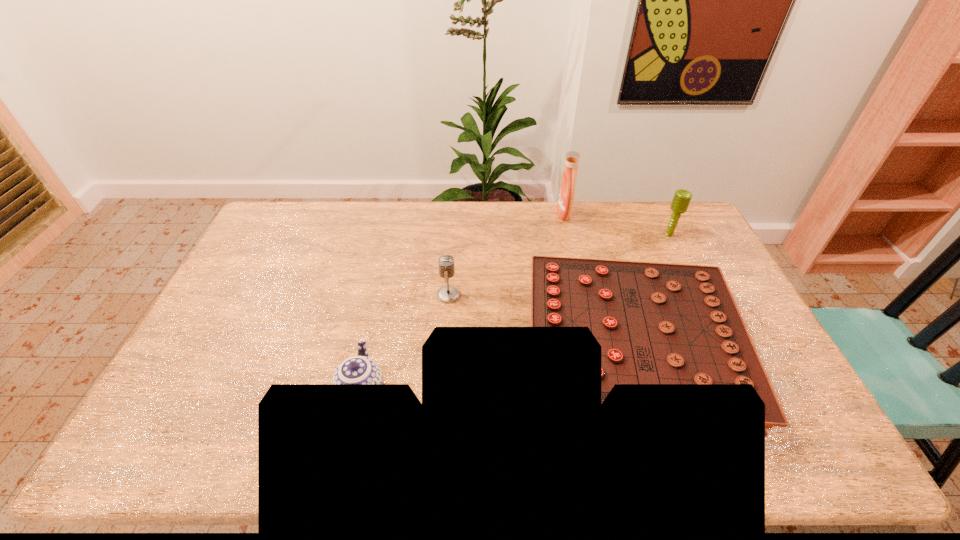
The width and height of the screenshot is (960, 540). I want to click on the tallest object, so click(x=567, y=189).

Find the location of a particular element. Image resolution: width=960 pixels, height=540 pixels. the farthest object is located at coordinates (567, 189).

This screenshot has width=960, height=540. I want to click on the right microphone, so click(682, 198).

Locate an element on the screen. the second farthest object is located at coordinates (682, 198).

Where is `the left microphone`? The width and height of the screenshot is (960, 540). the left microphone is located at coordinates (447, 294).

The image size is (960, 540). Identify the location of the nearer microphone. (447, 294).

Locate an element on the screen. The width and height of the screenshot is (960, 540). chinaware is located at coordinates (360, 369).

The image size is (960, 540). What are the coordinates of `gameboard` in the screenshot? It's located at (657, 323).

Identify the location of free space located 0.130m on the front-facing side of the farthest object. tap(523, 214).

This screenshot has width=960, height=540. What are the coordinates of `vacant area situated on the front-facing side of the farthest object` in the screenshot? It's located at (464, 214).